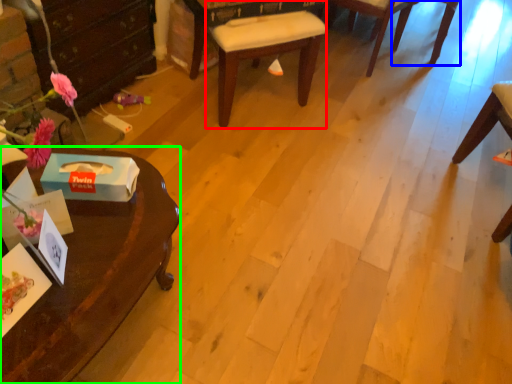
Question: Considering the real-world distances, which object is farthest from chair (highlighted by a red box)? chair (highlighted by a blue box) or desk (highlighted by a green box)?

Choices:
 (A) chair
 (B) desk

Answer: (A)